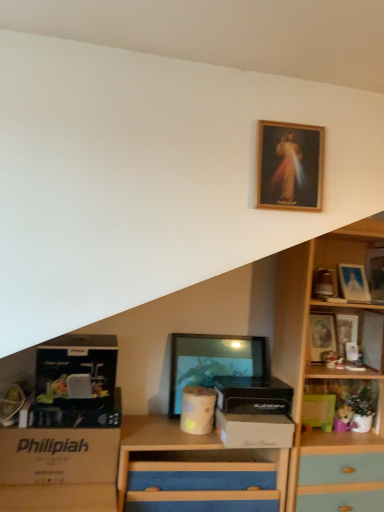
Question: Is matte silver picture frame at upper right, the second picture frame from the right, to the right of green matte box at lower right, the 1th box in the right-to-left sequence, from the viewer's perspective?

Choices:
 (A) no
 (B) yes

Answer: (B)

Question: Can you confirm if matte silver picture frame at upper right, the 5th picture frame from the left, is positioned to the left of green matte box at lower right, the 1th box in the right-to-left sequence?

Choices:
 (A) yes
 (B) no

Answer: (B)

Question: Is matte silver picture frame at upper right, placed as the 5th picture frame when sorted from front to back, bigger than green matte box at lower right, the 1th box in the right-to-left sequence?

Choices:
 (A) no
 (B) yes

Answer: (B)

Question: From the image's perspective, does matte silver picture frame at upper right, the 2th picture frame in the back-to-front sequence, appear higher than green matte box at lower right, positioned as the third box in top-to-bottom order?

Choices:
 (A) yes
 (B) no

Answer: (A)

Question: Can you confirm if matte silver picture frame at upper right, the 5th picture frame from the left, is smaller than green matte box at lower right, the third box positioned from the left?

Choices:
 (A) yes
 (B) no

Answer: (B)

Question: From a real-world perspective, relative to wooden picture frame at upper right, placed as the 5th picture frame when sorted from back to front, is white cardboard box at lower left, arranged as the first storage box when viewed from the left, vertically above or below?

Choices:
 (A) below
 (B) above

Answer: (A)

Question: Is white cardboard box at lower left, which is the second storage box from right to left, spatially inside wooden picture frame at upper right, positioned as the sixth picture frame in left-to-right order, or outside of it?

Choices:
 (A) inside
 (B) outside

Answer: (B)

Question: Is white cardboard box at lower left, arranged as the first storage box when viewed from the left, to the left or to the right of wooden picture frame at upper right, positioned as the sixth picture frame in left-to-right order, in the image?

Choices:
 (A) right
 (B) left

Answer: (B)

Question: Is point (6, 468) closer or farther from the camera than point (380, 274)?

Choices:
 (A) farther
 (B) closer

Answer: (B)

Question: Looking at their shapes, would you say green matte box at lower right, positioned as the third box in top-to-bottom order, is wider or thinner than wooden picture frame at upper right, which is the fourth picture frame from left to right?

Choices:
 (A) wide
 (B) thin

Answer: (A)

Question: From the image's perspective, is green matte box at lower right, which is counted as the 1th box, starting from the bottom, above or below wooden picture frame at upper right, placed as the first picture frame when sorted from back to front?

Choices:
 (A) above
 (B) below

Answer: (B)

Question: In terms of size, does green matte box at lower right, the 1th box in the right-to-left sequence, appear bigger or smaller than wooden picture frame at upper right, which is the fourth picture frame from left to right?

Choices:
 (A) small
 (B) big

Answer: (B)

Question: From a real-world perspective, is green matte box at lower right, the 1th box in the right-to-left sequence, physically located above or below wooden picture frame at upper right, the sixth picture frame in the front-to-back sequence?

Choices:
 (A) above
 (B) below

Answer: (B)

Question: Considering their positions, is wooden picture frame at upper right, positioned as the sixth picture frame in left-to-right order, located in front of or behind green matte box at lower right, which is counted as the 1th box, starting from the bottom?

Choices:
 (A) front
 (B) behind

Answer: (A)

Question: Does point (367, 268) appear closer or farther from the camera than point (314, 417)?

Choices:
 (A) closer
 (B) farther

Answer: (B)